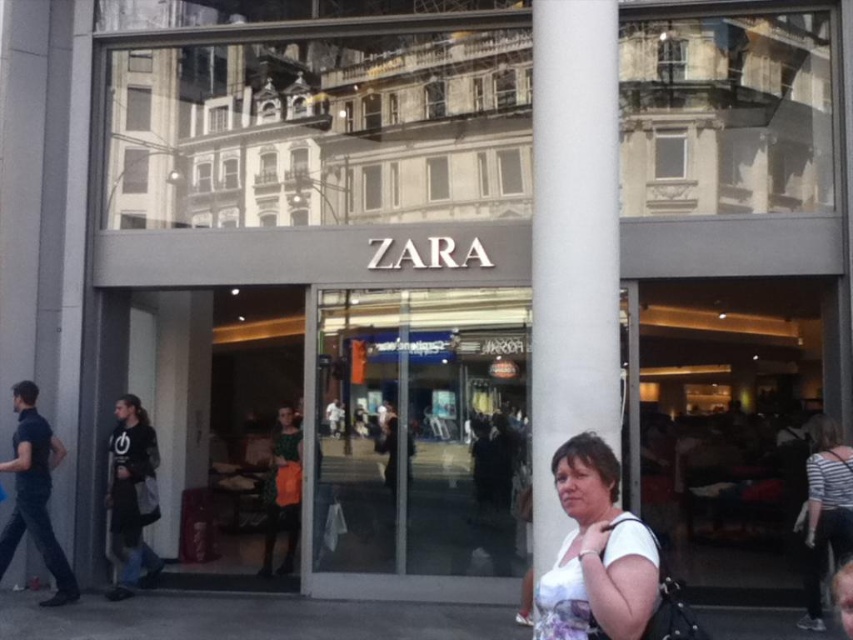
Looking at this image, you are standing in front of the Zara store and want to take a photo of the white smooth pillar at center. Where should you position yourself to capture the pillar in the frame?

The white smooth pillar at center is located at coordinates point (572,243), so you should position yourself directly in front of the pillar to capture it in the frame.

You are standing at the Zara store entrance and want to locate two specific points marked on the glass window. The first point is at coordinate point [598,508] and the second is at point [839,486]. From your current position, which point is closer to you?

Point [598,508] is in front of point [839,486], so the first point is closer to you.